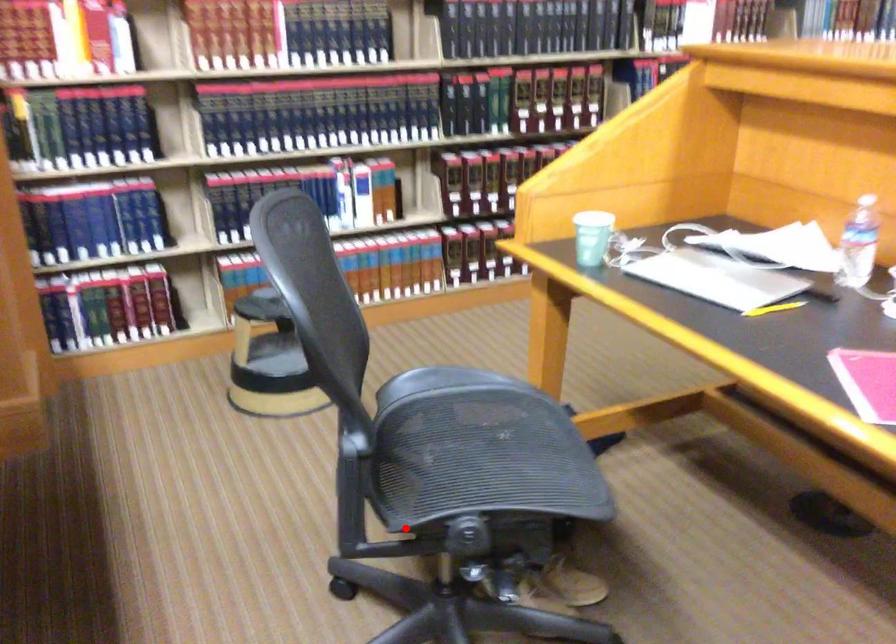
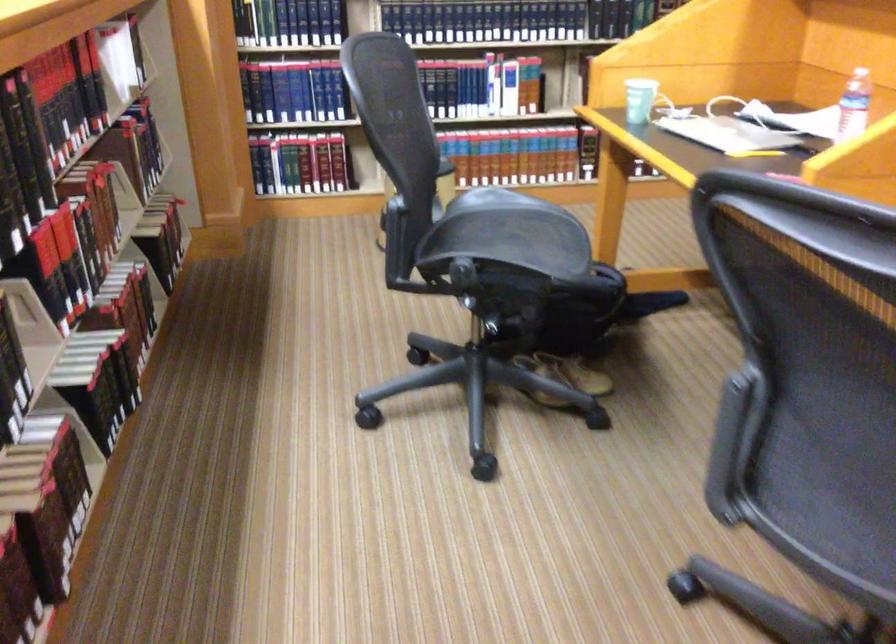
Question: A red point is marked in image1. In image2, is the corresponding 3D point closer to the camera or farther? Reply with the corresponding letter.

Choices:
 (A) The corresponding 3D point is closer.
 (B) The corresponding 3D point is farther.

Answer: (B)